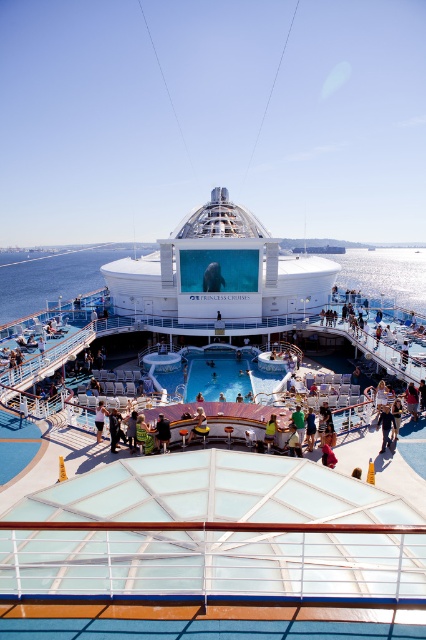
Question: Which object is positioned farthest from the blue glossy pool at center?

Choices:
 (A) dark blue jeans at center
 (B) tan leather jacket at center
 (C) yellow fabric at center
 (D) green fabric shirt at center

Answer: (D)

Question: Considering the relative positions of dark brown leather jacket at center and dark blue fabric shorts at center in the image provided, where is dark brown leather jacket at center located with respect to dark blue fabric shorts at center?

Choices:
 (A) above
 (B) below

Answer: (B)

Question: Which object is positioned farthest from the dark blue jeans at center?

Choices:
 (A) yellow fabric at center
 (B) dark brown leather jacket at center

Answer: (B)

Question: Does dark blue jeans at center have a greater width compared to green fabric shirt at center?

Choices:
 (A) yes
 (B) no

Answer: (A)

Question: Does dark blue jeans at center have a larger size compared to yellow fabric at center?

Choices:
 (A) no
 (B) yes

Answer: (B)

Question: Which object is the farthest from the yellow fabric at center?

Choices:
 (A) dark blue jeans at center
 (B) dark blue fabric shorts at center

Answer: (A)